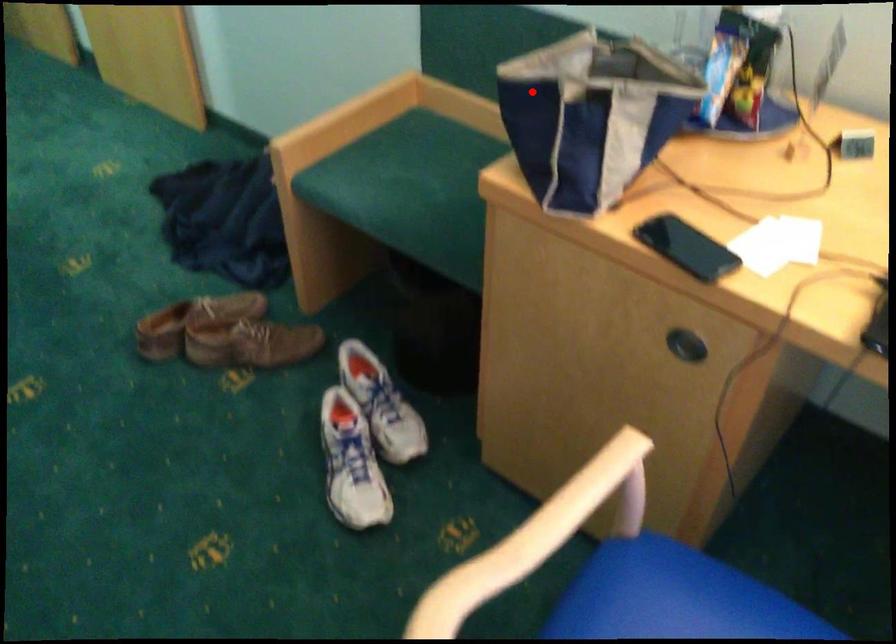
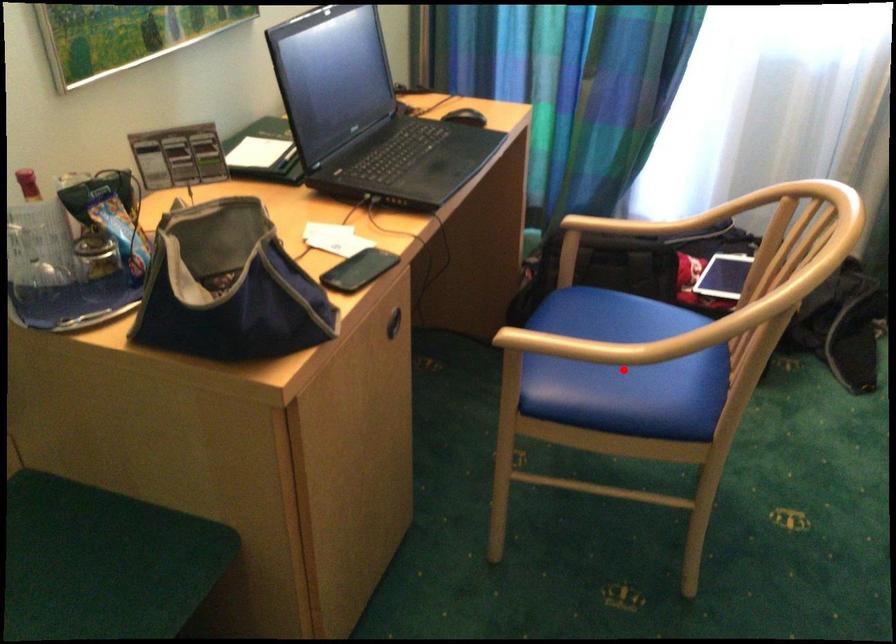
I am providing you with two images of the same scene from different viewpoints. A red point is marked on the first image and another point is marked on the second image. Is the red point in image1 aligned with the point shown in image2?

No